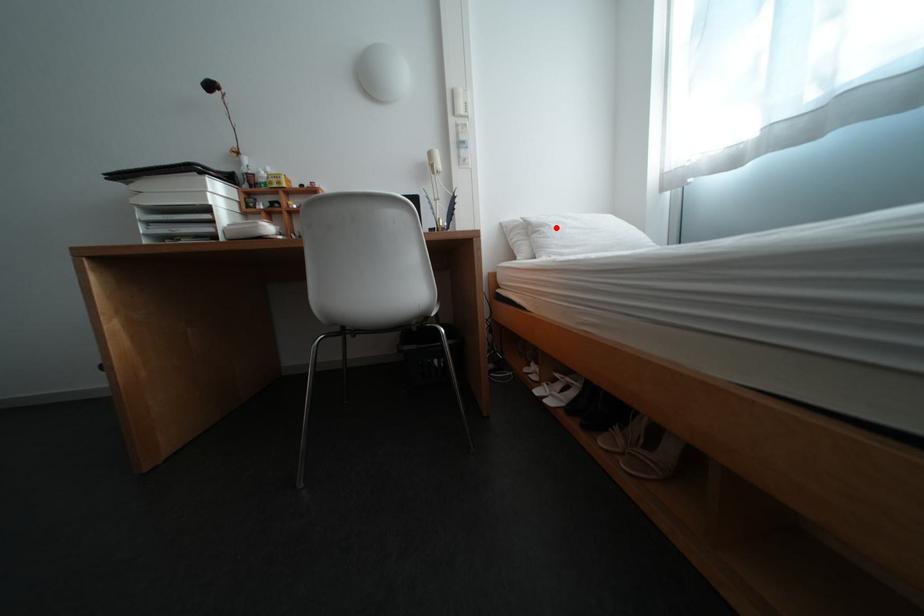
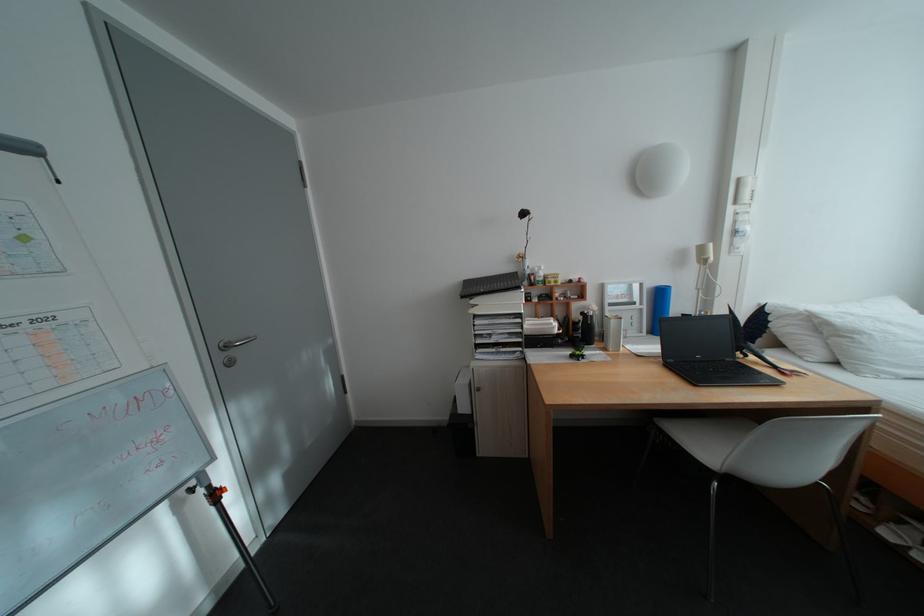
Find the pixel in the second image that matches the highlighted location in the first image.

(871, 334)